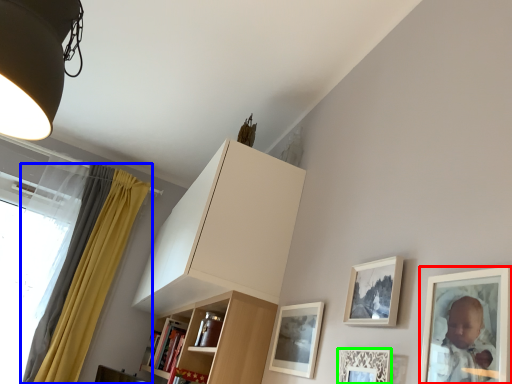
Question: Which object is the closest to the picture frame (highlighted by a red box)? Choose among these: curtain (highlighted by a blue box) or picture frame (highlighted by a green box).

Choices:
 (A) curtain
 (B) picture frame

Answer: (B)